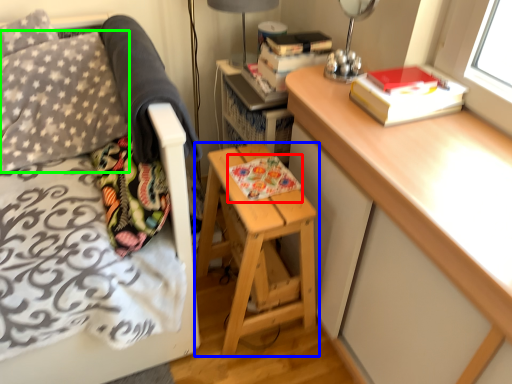
Question: Considering the real-world distances, which object is farthest from book (highlighted by a red box)? stool (highlighted by a blue box) or throw pillow (highlighted by a green box)?

Choices:
 (A) stool
 (B) throw pillow

Answer: (B)